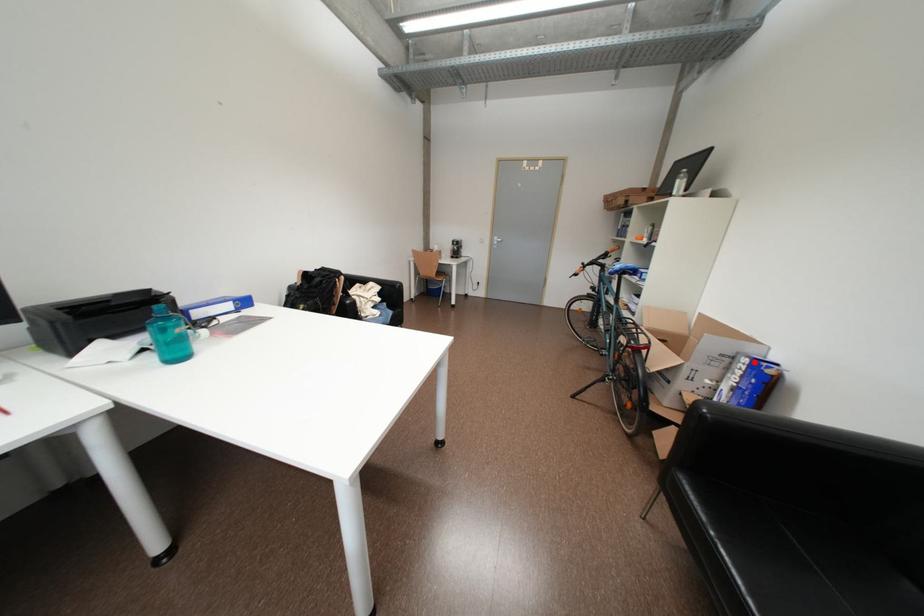
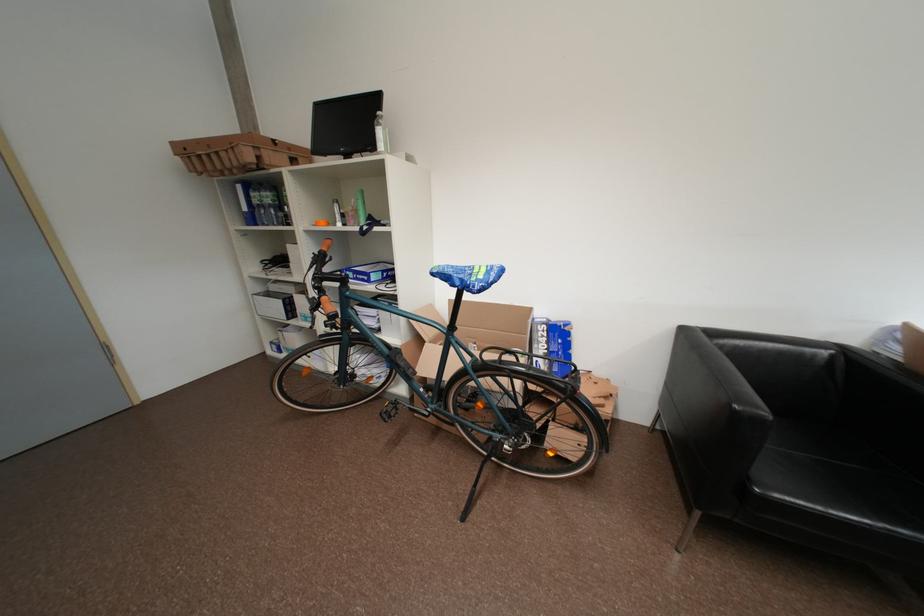
Question: I am providing you with two images of the same scene from different viewpoints. A red point is marked on the first image. Can you still see the location of the red point in image 2?

Choices:
 (A) Yes
 (B) No

Answer: (A)